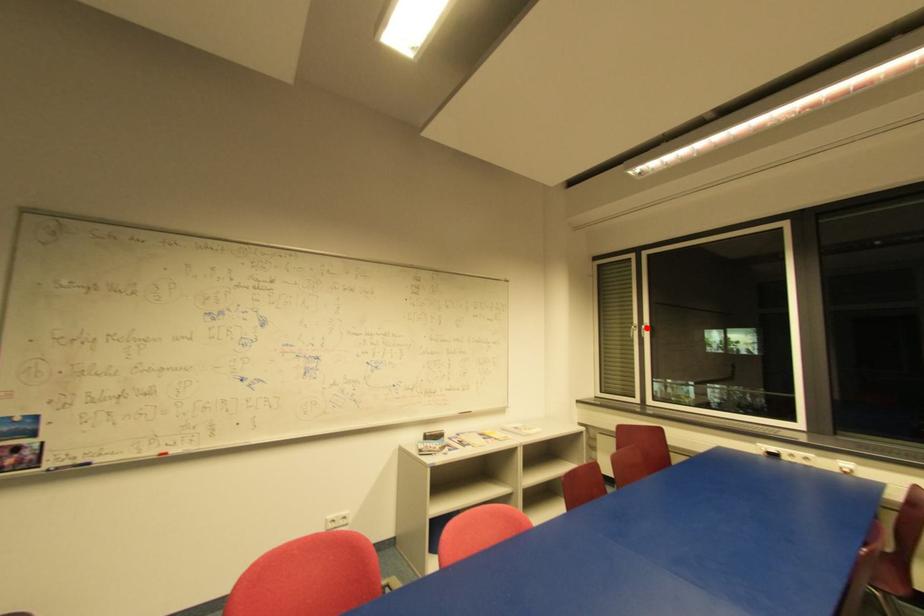
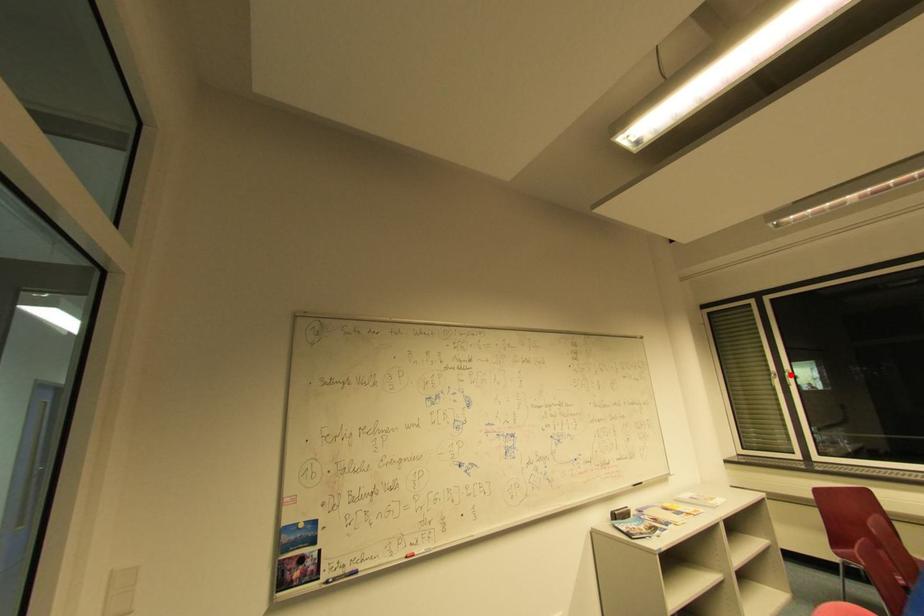
I am providing you with two images of the same scene from different viewpoints. A red point is marked on the first image and another point is marked on the second image. Are the points marked in image1 and image2 representing the same 3D position?

Yes